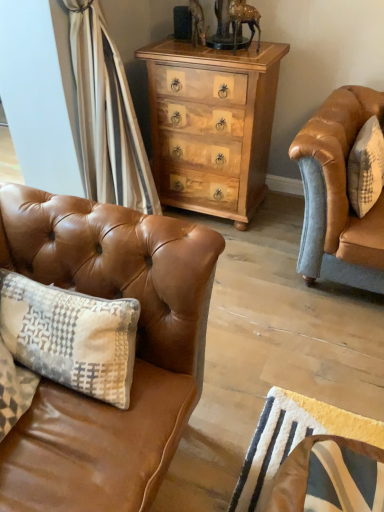
At what (x,y) coordinates should I click in order to perform the action: click on vacant area that is in front of light brown wood chest of drawers at center. Please return your answer as a coordinate pair (x, y). Looking at the image, I should click on (253, 255).